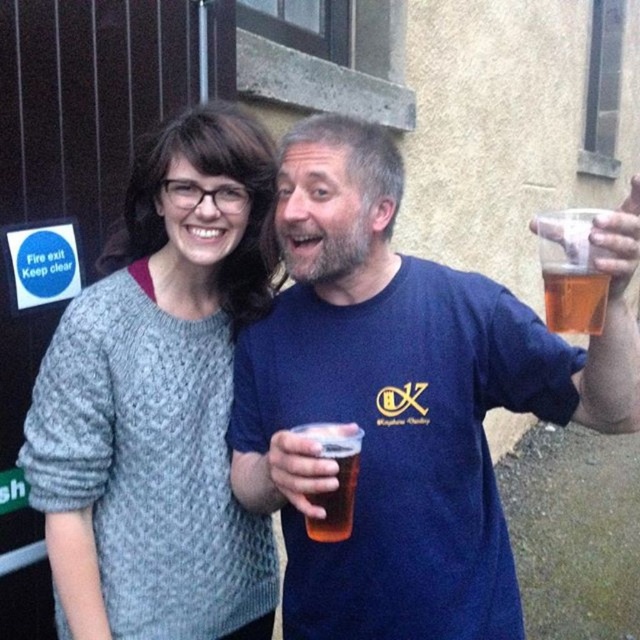
You are a photographer adjusting your camera settings to capture the scene. You need to focus on the knitted gray sweater at left and the translucent plastic cup at center. Which object should you adjust your focus to first if you want to ensure both are in sharp focus, considering their sizes?

The knitted gray sweater at left is larger in size than the translucent plastic cup at center, so you should focus on the knitted gray sweater at left first to ensure both are in sharp focus.

In the scene shown: You are a photographer trying to capture a closeup of the knitted gray sweater at left and the translucent plastic cup at center. Which object should you focus on first if you want to ensure both are in focus without moving the camera?

The knitted gray sweater at left is above the translucent plastic cup at center, so focusing on the knitted gray sweater at left first would ensure both are in focus since it is closer to the camera.